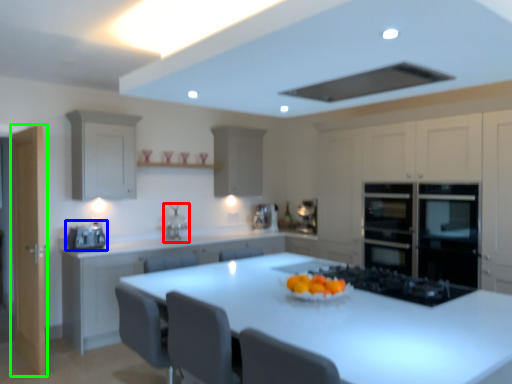
Question: Which object is the farthest from sink (highlighted by a red box)? Choose among these: home appliance (highlighted by a blue box) or glass door (highlighted by a green box).

Choices:
 (A) home appliance
 (B) glass door

Answer: (B)